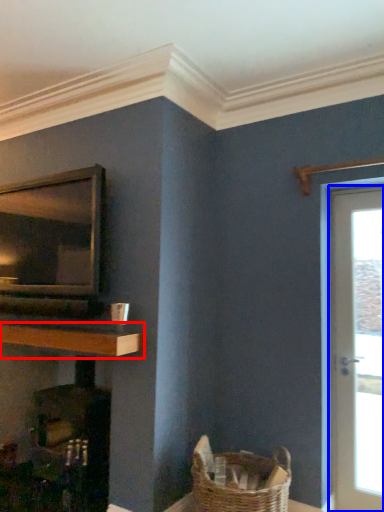
Question: Which of the following is the farthest to the observer, shelf (highlighted by a red box) or door (highlighted by a blue box)?

Choices:
 (A) shelf
 (B) door

Answer: (B)